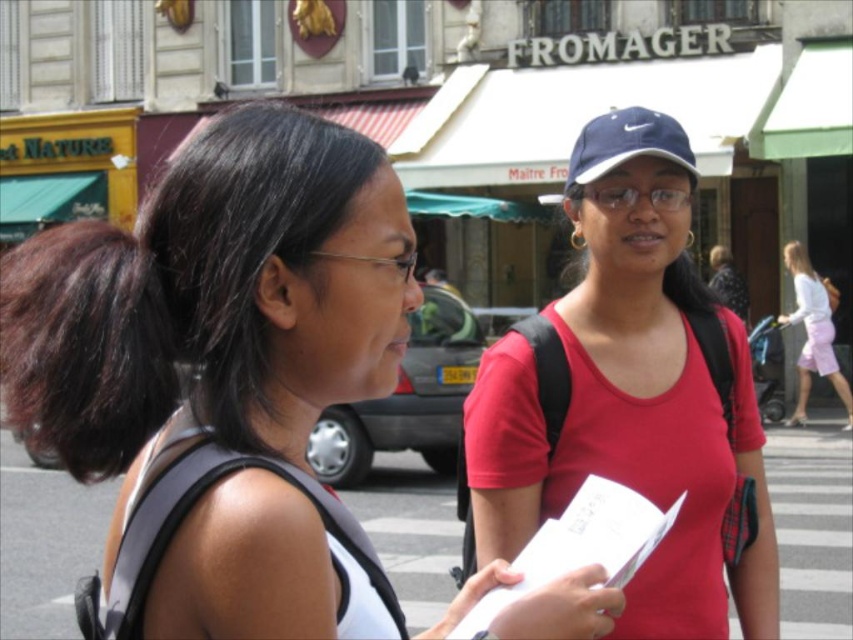
The height and width of the screenshot is (640, 853). What do you see at coordinates (630, 394) in the screenshot?
I see `red matte tank top at center` at bounding box center [630, 394].

Does point (671, 298) come closer to viewer compared to point (576, 186)?

No, it is not.

You are a GUI agent. You are given a task and a screenshot of the screen. Output one action in this format:
    pyautogui.click(x=<x>, y=<y>)
    Task: Click on the red matte tank top at center
    The image size is (853, 640).
    Given the screenshot: What is the action you would take?
    pyautogui.click(x=630, y=394)

Can you confirm if matte black backpack at left is positioned above navy blue fabric baseball cap at upper right?

Incorrect, matte black backpack at left is not positioned above navy blue fabric baseball cap at upper right.

Does matte black backpack at left have a greater height compared to navy blue fabric baseball cap at upper right?

Yes.

Which is in front, point (244, 260) or point (648, 113)?

Point (244, 260) is more forward.

Where is `matte black backpack at left`? The width and height of the screenshot is (853, 640). matte black backpack at left is located at coordinates (286, 275).

Is matte black backpack at left above red matte tank top at center?

Yes.

Is matte black backpack at left positioned at the back of red matte tank top at center?

No, matte black backpack at left is in front of red matte tank top at center.

Which is behind, point (190, 544) or point (685, 458)?

The point (685, 458) is behind.

Locate an element on the screen. matte black backpack at left is located at coordinates (286, 275).